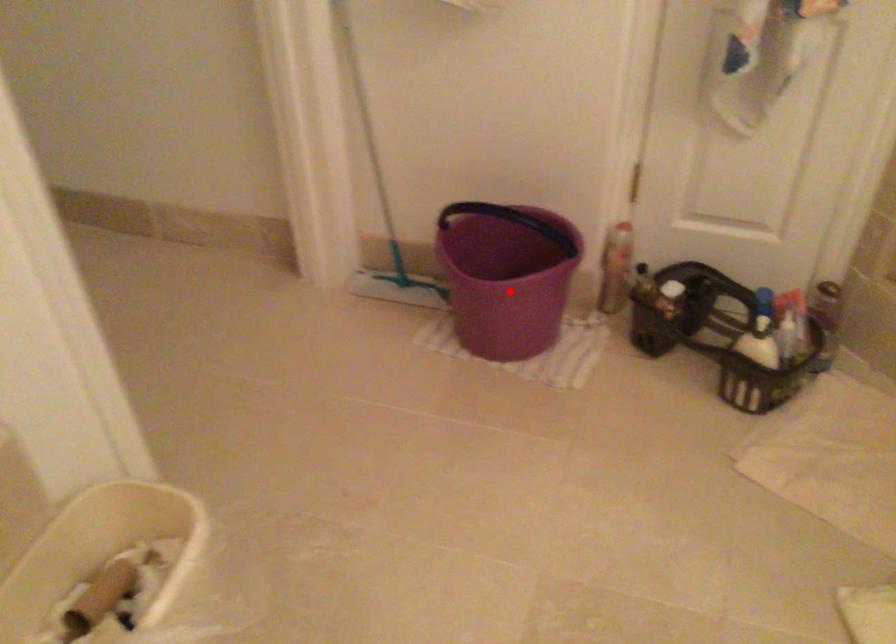
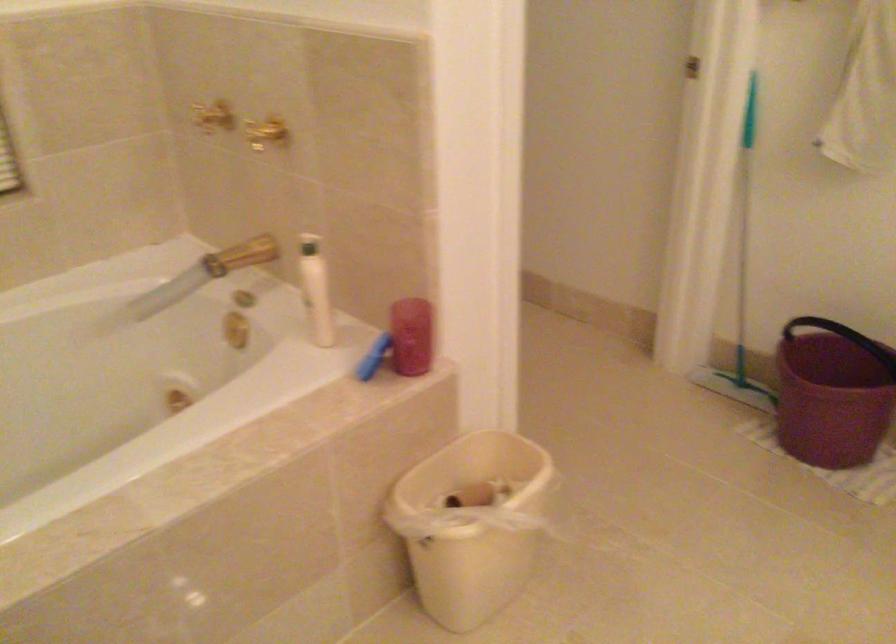
The point at the highlighted location is marked in the first image. Where is the corresponding point in the second image?

(831, 393)